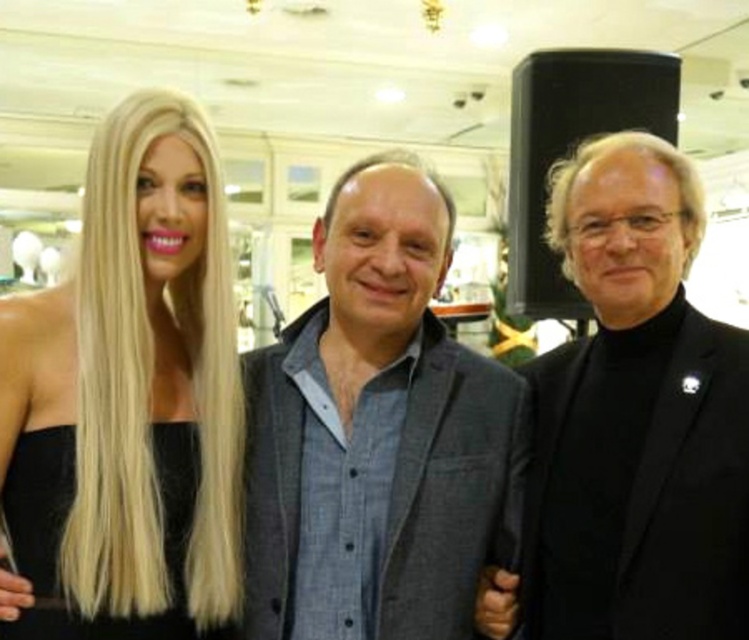
Question: Estimate the real-world distances between objects in this image. Which object is farther from the black matte suit at center?

Choices:
 (A) blonde hair at left
 (B) gray textured blazer at center

Answer: (A)

Question: Which of the following is the closest to the observer?

Choices:
 (A) (225, 362)
 (B) (694, 496)
 (C) (330, 316)

Answer: (B)

Question: Does gray textured blazer at center appear over blonde hair at left?

Choices:
 (A) yes
 (B) no

Answer: (B)

Question: Is gray textured blazer at center to the right of blonde hair at left from the viewer's perspective?

Choices:
 (A) yes
 (B) no

Answer: (A)

Question: Does gray textured blazer at center appear on the right side of blonde hair at left?

Choices:
 (A) yes
 (B) no

Answer: (A)

Question: Which point is farther to the camera?

Choices:
 (A) (542, 515)
 (B) (233, 355)
 (C) (457, 554)

Answer: (A)